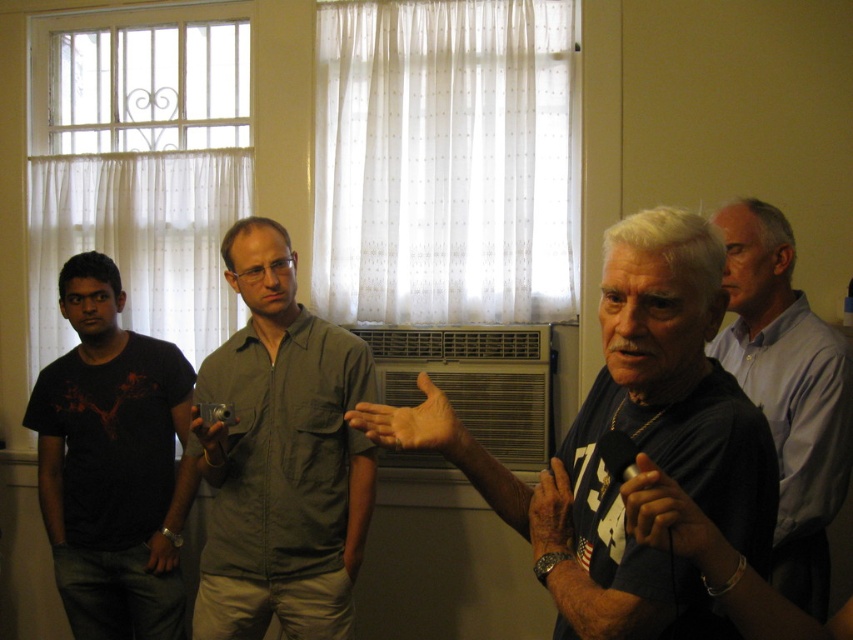
Question: Which of the following is the farthest from the observer?

Choices:
 (A) (453, 452)
 (B) (782, 349)
 (C) (245, 372)

Answer: (C)

Question: Can you confirm if light blue shirt at right is positioned above brown leather hand at center?

Choices:
 (A) no
 (B) yes

Answer: (A)

Question: Which object appears farthest from the camera in this image?

Choices:
 (A) dry skin hand at center
 (B) gray cotton shirt at center
 (C) matte black hand at center
 (D) black cotton t-shirt at left

Answer: (D)

Question: Which object appears farthest from the camera in this image?

Choices:
 (A) light blue shirt at right
 (B) black cotton t-shirt at left

Answer: (B)

Question: Is matte black hand at center smaller than brown leather hand at center?

Choices:
 (A) yes
 (B) no

Answer: (A)

Question: Is light blue shirt at right above dry skin hand at center?

Choices:
 (A) no
 (B) yes

Answer: (B)